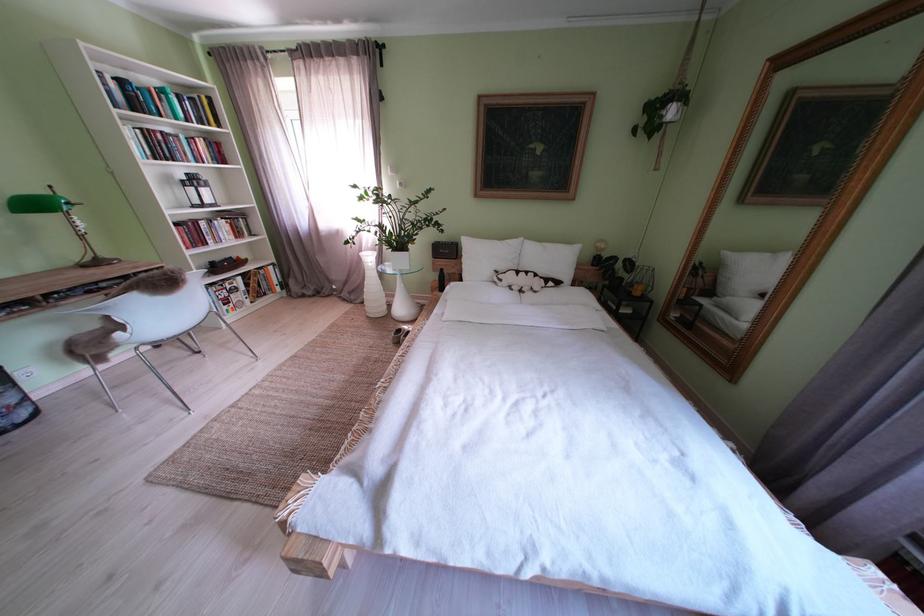
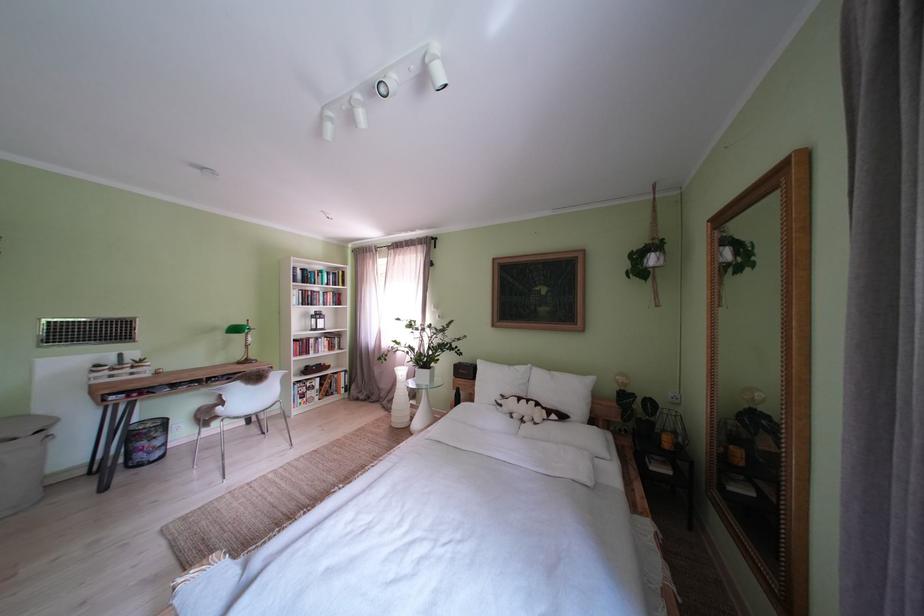
The point at (490, 262) is marked in the first image. Where is the corresponding point in the second image?

(500, 386)